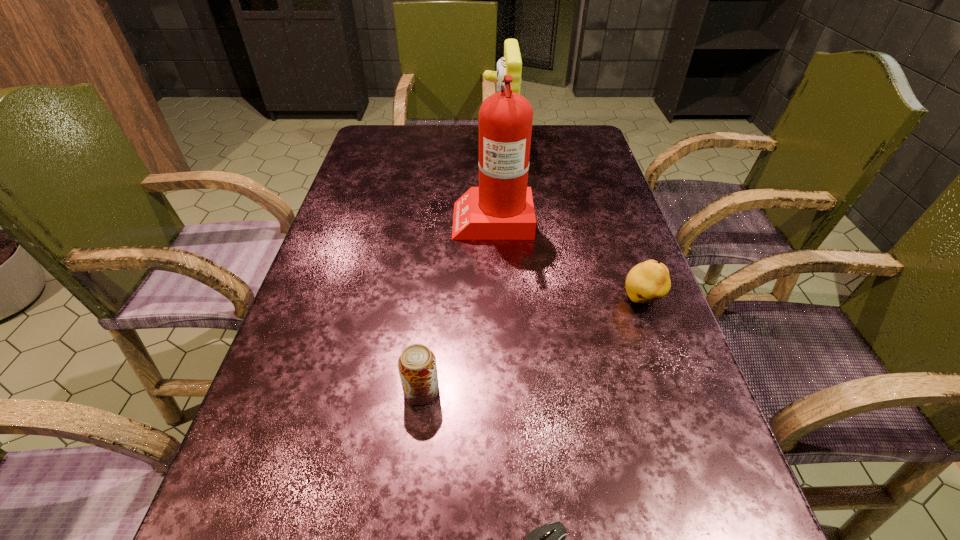
Locate an element on the screen. This screenshot has height=540, width=960. free spot that satisfies the following two spatial constraints: 1. on the front-facing side of the pear; 2. on the right side of the fire extinguisher is located at coordinates (495, 300).